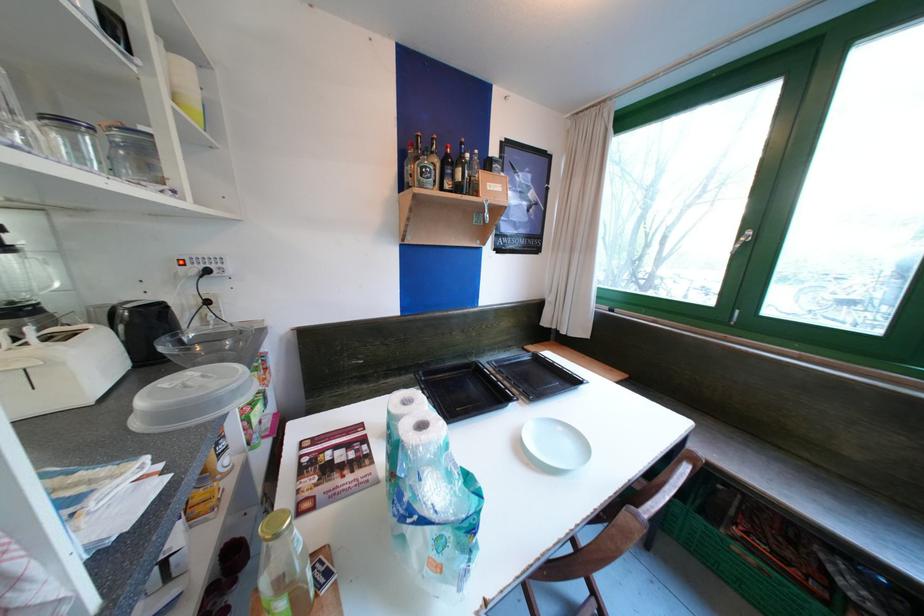
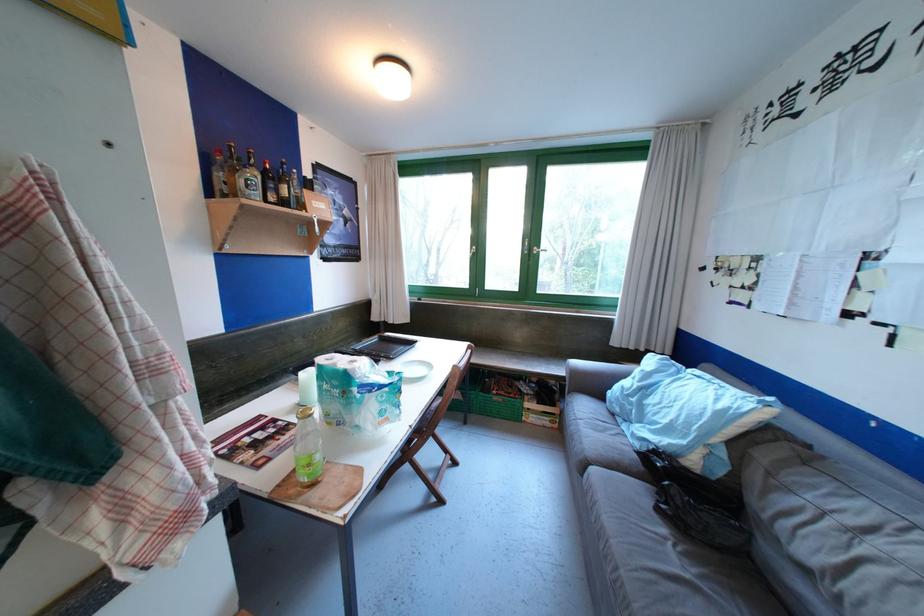
Question: I am providing you with two images of the same scene from different viewpoints. Please identify which objects are invisible in image2.

Choices:
 (A) clear glass bottle
 (B) white bowl
 (C) coffee tamper handle
 (D) metal bottle opener

Answer: (D)